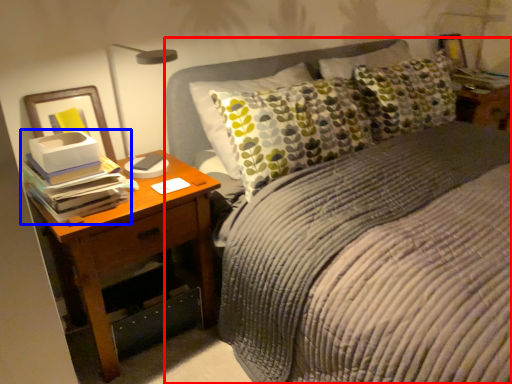
Question: Among these objects, which one is nearest to the camera, bed (highlighted by a red box) or book (highlighted by a blue box)?

Choices:
 (A) bed
 (B) book

Answer: (A)